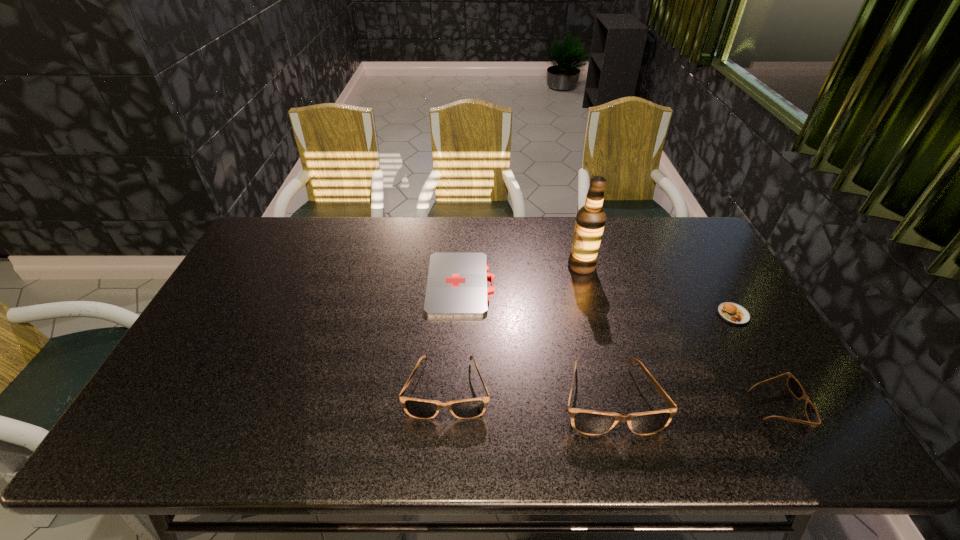
Identify the location of the second tallest sunglasses. (472, 408).

Where is `the leftmost sunglasses`? Image resolution: width=960 pixels, height=540 pixels. the leftmost sunglasses is located at coordinates (472, 408).

This screenshot has width=960, height=540. In order to click on the second sunglasses from right to left in this screenshot , I will do `click(589, 422)`.

You are a GUI agent. You are given a task and a screenshot of the screen. Output one action in this format:
    pyautogui.click(x=<x>, y=<y>)
    Task: Click on the shortest sunglasses
    
    Given the screenshot: What is the action you would take?
    pyautogui.click(x=794, y=386)

Image resolution: width=960 pixels, height=540 pixels. Find the location of `patty`. patty is located at coordinates (732, 313).

The height and width of the screenshot is (540, 960). In order to click on the first-aid kit in this screenshot , I will do `click(456, 286)`.

The image size is (960, 540). I want to click on the tallest object, so click(x=590, y=220).

Locate an element on the screen. Image resolution: width=960 pixels, height=540 pixels. free region located on the front of the patty is located at coordinates 750,343.

Locate an element on the screen. Image resolution: width=960 pixels, height=540 pixels. free space located on handle side the first-aid kit is located at coordinates (510, 285).

Identify the location of free space located on the label of the tallest object. Image resolution: width=960 pixels, height=540 pixels. (486, 266).